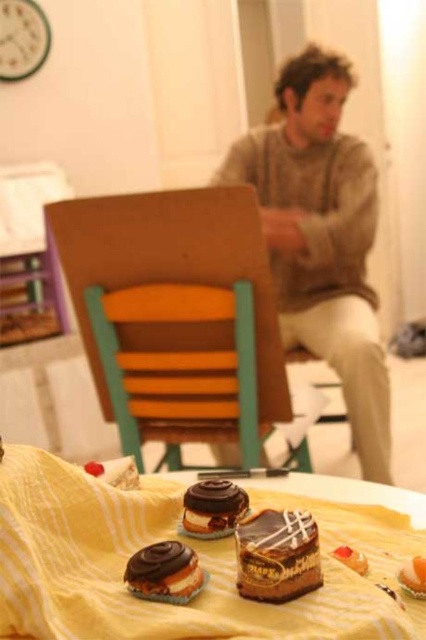
You are standing in the room and see the brown knitted sweater at upper center located at point (322, 237). If you want to place a small object on the table, which is at point 0.5, 0.5, would the sweater be in your way?

The brown knitted sweater at upper center is located at point (322, 237), which is above the table at 0.5, 0.5. Since the sweater is on the upper part of the image, it would not be in the way of placing an object on the table.

From the picture: You are a baker who wants to place both the chocolate frosted cake at center and the chocolate glazed donut at center on a shelf. The shelf has a height limit of 12 inches. Can both items fit on the shelf without exceeding the height limit?

The chocolate frosted cake at center is much taller than the chocolate glazed donut at center. Since the shelf has a height limit of 12 inches, it depends on the exact height of the cake. If the cake is under 12 inches, both can fit. However, if the cake exceeds 12 inches, it won